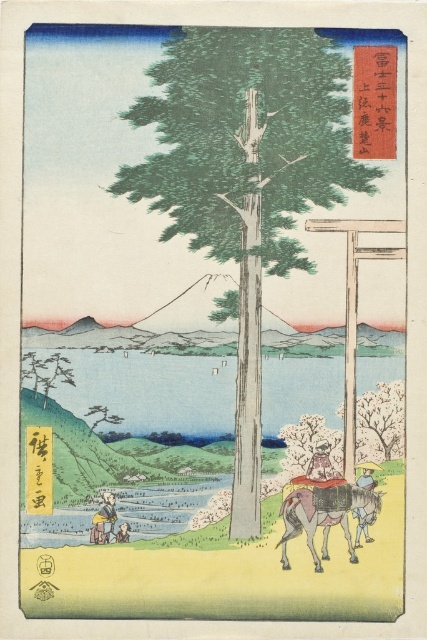
Between green matte tree at lower left and light brown paper bag at lower center, which one appears on the right side from the viewer's perspective?

light brown paper bag at lower center is more to the right.

Who is more distant from viewer, (44,392) or (128,524)?

Positioned behind is point (44,392).

At what (x,y) coordinates should I click in order to perform the action: click on green matte tree at lower left. Please return your answer as a coordinate pair (x, y). Image resolution: width=427 pixels, height=640 pixels. Looking at the image, I should click on (46, 372).

Can you confirm if green textured tree at center is bigger than wooden figure at center?

Correct, green textured tree at center is larger in size than wooden figure at center.

Between green textured tree at center and wooden figure at center, which one has more height?

With more height is green textured tree at center.

Between point (254, 291) and point (315, 477), which one is positioned in front?

Point (315, 477) is more forward.

Locate an element on the screen. The height and width of the screenshot is (640, 427). green textured tree at center is located at coordinates (245, 179).

Does cherry blossom tree at center appear over green matte tree at lower left?

Actually, cherry blossom tree at center is below green matte tree at lower left.

Is cherry blossom tree at center below green matte tree at lower left?

Yes, cherry blossom tree at center is below green matte tree at lower left.

Who is more forward, (379,394) or (56,380)?

Point (56,380)

This screenshot has height=640, width=427. I want to click on cherry blossom tree at center, so click(383, 413).